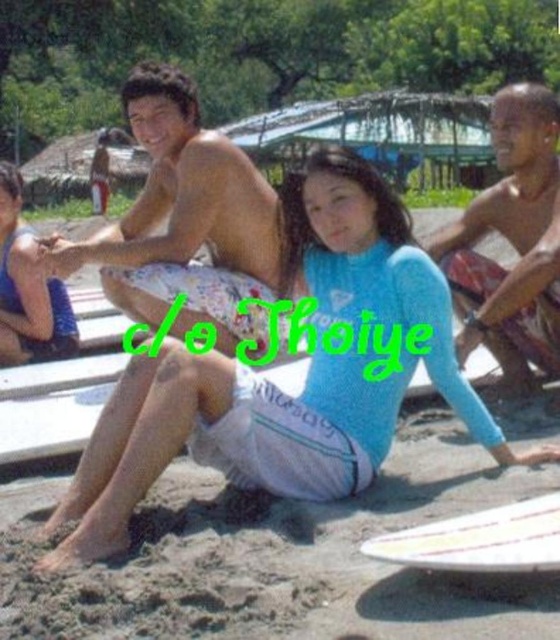
You are a photographer trying to capture a photo of the beach scene. You need to ensure that both the blue wetsuit at center and the blue wetsuit at lower left are clearly visible in your shot. Given their sizes, which one might appear larger in the photo?

The blue wetsuit at center appears larger in the photo because it is much taller than the blue wetsuit at lower left.

You are a photographer trying to capture a clear shot of both the blue wetsuit at center and the blue rubber duck at center. Since they are both blue, how can you distinguish them in your photo?

The blue wetsuit at center is larger in size than the blue rubber duck at center, so you can distinguish them by their size difference.

You are a photographer standing at the camera position. You want to place a small flag at the point closer to you between point [53,548] and point [190,160]. Which point should you choose?

Point [53,548] is closer to the camera than point [190,160], so you should place the flag at point [53,548].